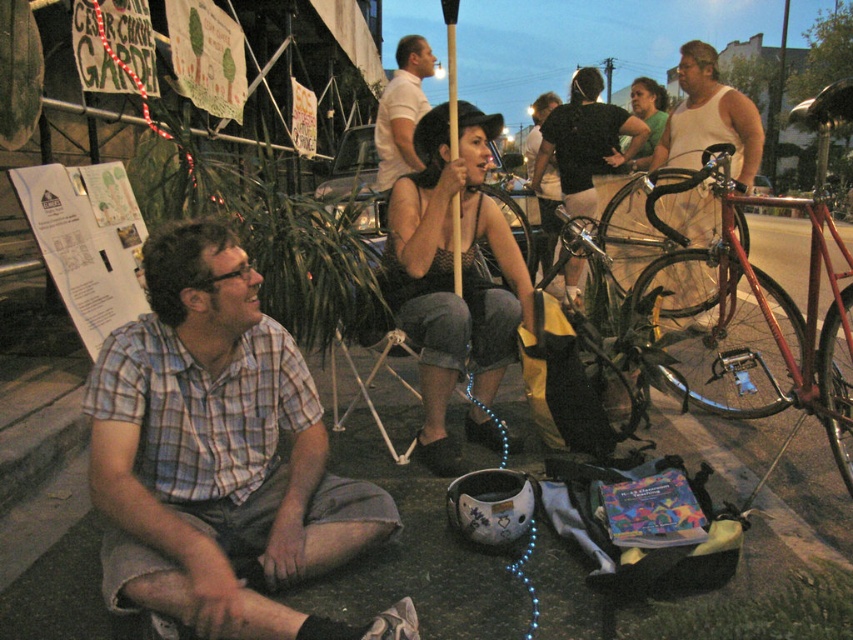
You are a photographer trying to capture a wide shot of the scene. The plaid cotton shirt at lower left and the shiny red bicycle at right are both in your frame. Considering their sizes, which object would require you to zoom out more to ensure both are fully visible?

The shiny red bicycle at right is wider than the plaid cotton shirt at lower left. To ensure both are fully visible in the wide shot, you would need to zoom out more to accommodate the larger width of the shiny red bicycle at right.

You are a photographer trying to capture both the plaid cotton shirt at lower left and the shiny red bicycle at right in a single frame. Based on their positions, which object should you focus on first to ensure both are in the shot?

The plaid cotton shirt at lower left is located below the shiny red bicycle at right, so you should focus on the shiny red bicycle at right first to ensure both are in the shot.